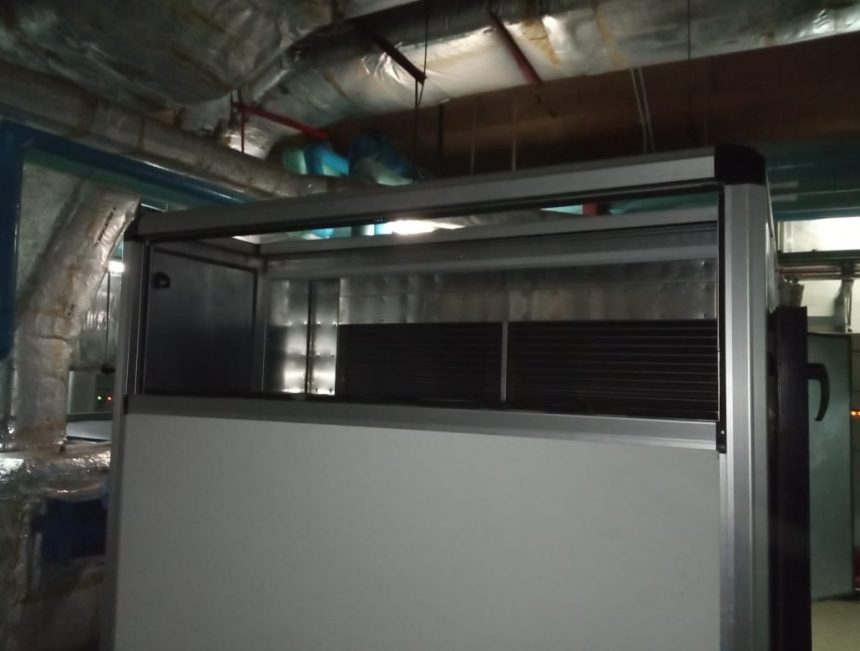
Where is `handle`? The height and width of the screenshot is (651, 860). handle is located at coordinates (826, 391).